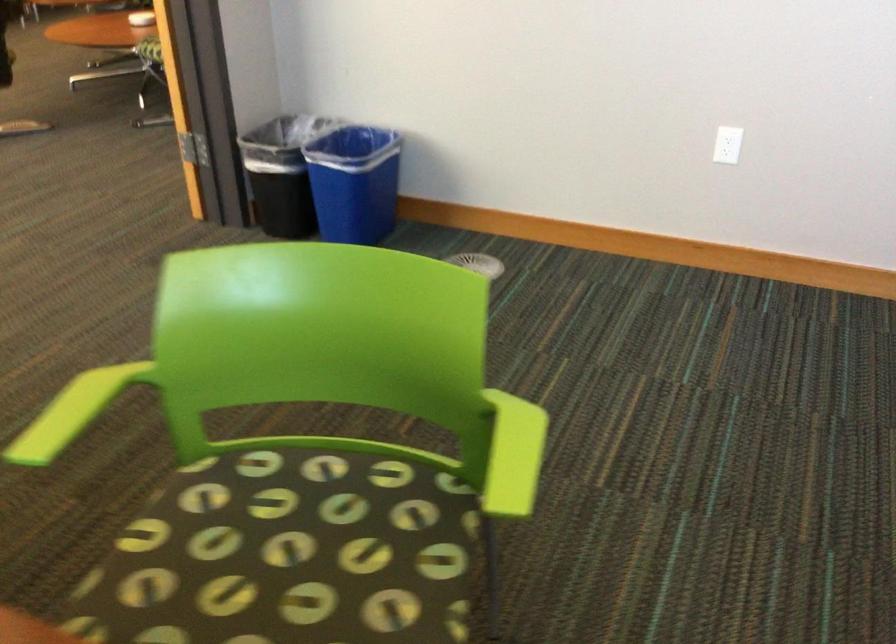
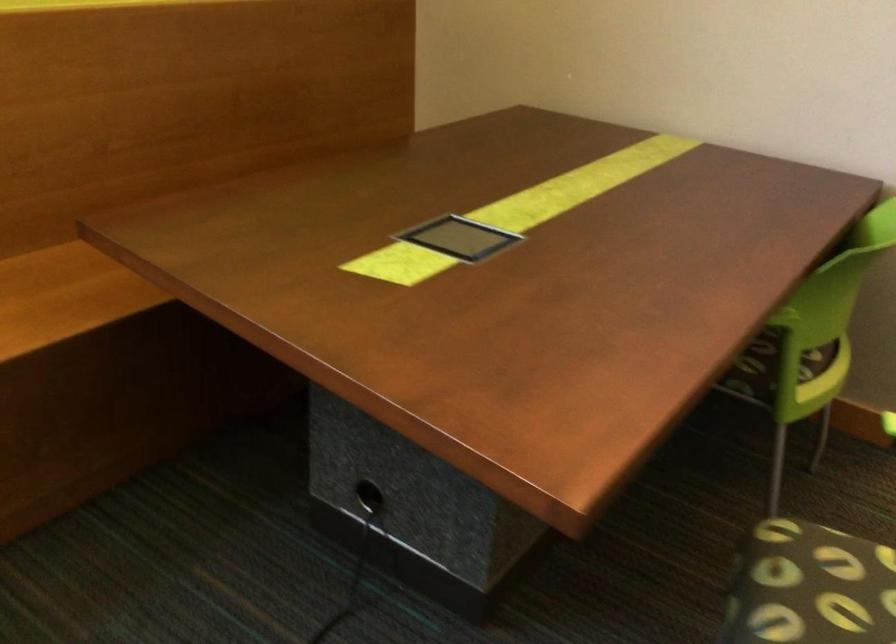
First-person continuous shooting, in which direction is the camera rotating?

The rotation direction of the camera is left-down.